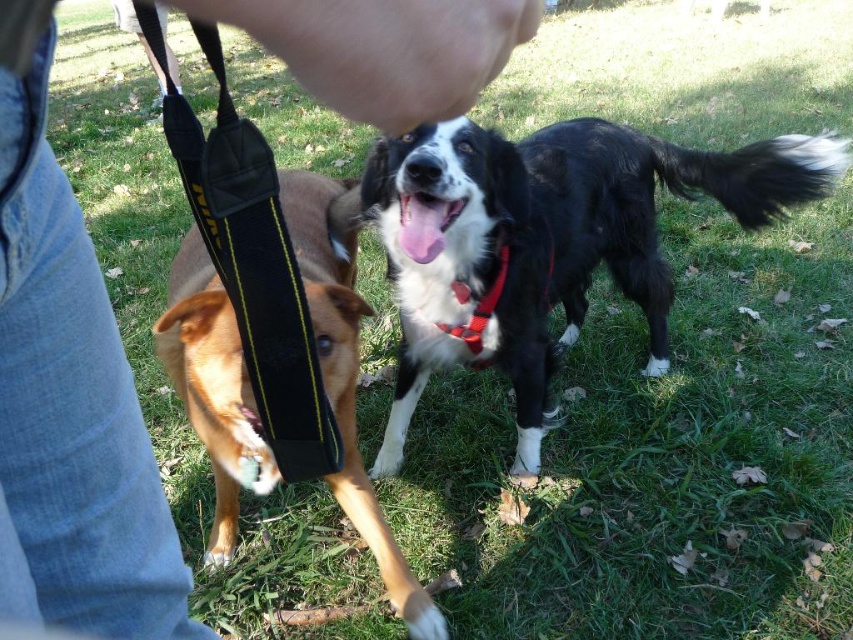
Does pink rubber dog mouth at center appear on the right side of red fabric neckband at center?

Incorrect, pink rubber dog mouth at center is not on the right side of red fabric neckband at center.

Can you confirm if pink rubber dog mouth at center is positioned to the left of red fabric neckband at center?

Yes, pink rubber dog mouth at center is to the left of red fabric neckband at center.

Is point (399, 214) positioned before point (494, 280)?

Yes, it is.

Locate an element on the screen. The width and height of the screenshot is (853, 640). pink rubber dog mouth at center is located at coordinates (424, 225).

Between jeans at lower left and pink rubber dog mouth at center, which one is positioned lower?

jeans at lower left is below.

Who is positioned more to the right, jeans at lower left or pink rubber dog mouth at center?

pink rubber dog mouth at center is more to the right.

Between point (300, 68) and point (416, 252), which one is positioned behind?

Positioned behind is point (416, 252).

The width and height of the screenshot is (853, 640). Find the location of `jeans at lower left`. jeans at lower left is located at coordinates (68, 397).

Consider the image. Which is below, black neoprene strap at left or pink rubber dog mouth at center?

black neoprene strap at left is below.

Does black neoprene strap at left lie behind pink rubber dog mouth at center?

No, it is not.

Locate an element on the screen. This screenshot has width=853, height=640. black neoprene strap at left is located at coordinates (251, 260).